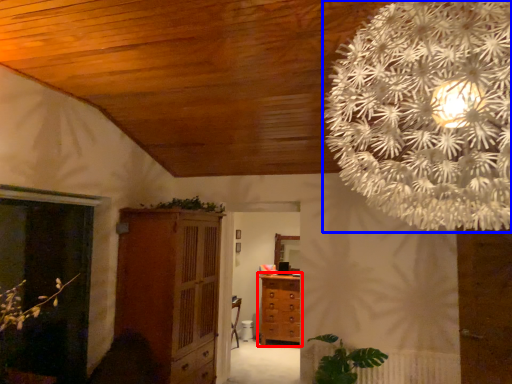
Question: Among these objects, which one is farthest to the camera, chest of drawers (highlighted by a red box) or flower (highlighted by a blue box)?

Choices:
 (A) chest of drawers
 (B) flower

Answer: (A)